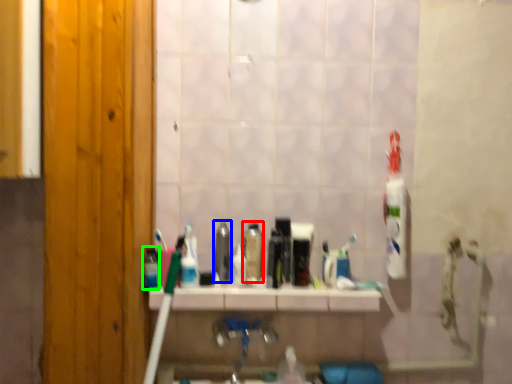
Question: Which object is positioned closest to mouthwash (highlighted by a red box)? Select from mouthwash (highlighted by a blue box) and mouthwash (highlighted by a green box).

Choices:
 (A) mouthwash
 (B) mouthwash

Answer: (A)